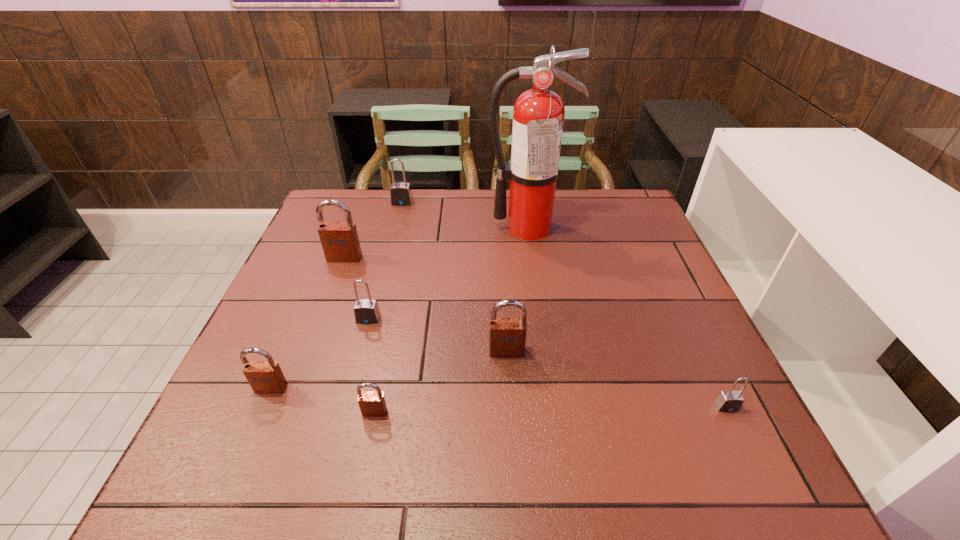
This screenshot has height=540, width=960. What are the coordinates of `vacant space situated 0.050m on the shackle of the second smallest gray padlock` in the screenshot? It's located at point(363,341).

Identify the location of vacant space located 0.170m on the front-facing side of the fifth farthest padlock. (232, 481).

Identify the location of blank area located on the shackle of the smallest gray padlock. (754, 464).

The width and height of the screenshot is (960, 540). Find the location of `free spot located on the front-facing side of the smallest brown padlock`. free spot located on the front-facing side of the smallest brown padlock is located at coordinates (366, 458).

Where is `fire extinguisher present at the far edge`? The height and width of the screenshot is (540, 960). fire extinguisher present at the far edge is located at coordinates (538, 116).

You are a GUI agent. You are given a task and a screenshot of the screen. Output one action in this format:
    pyautogui.click(x=<x>, y=<y>)
    Task: Click on the padlock present at the far edge
    
    Given the screenshot: What is the action you would take?
    pyautogui.click(x=400, y=193)

This screenshot has width=960, height=540. What are the coordinates of `object located at the right edge` in the screenshot? It's located at pyautogui.click(x=729, y=401).

Where is `vacant space at the far edge of the desktop`? The width and height of the screenshot is (960, 540). vacant space at the far edge of the desktop is located at coordinates (484, 205).

Find the location of a particular element. vacant space at the near edge of the desktop is located at coordinates (553, 458).

Image resolution: width=960 pixels, height=540 pixels. In order to click on free location at the left edge in this screenshot , I will do `click(288, 418)`.